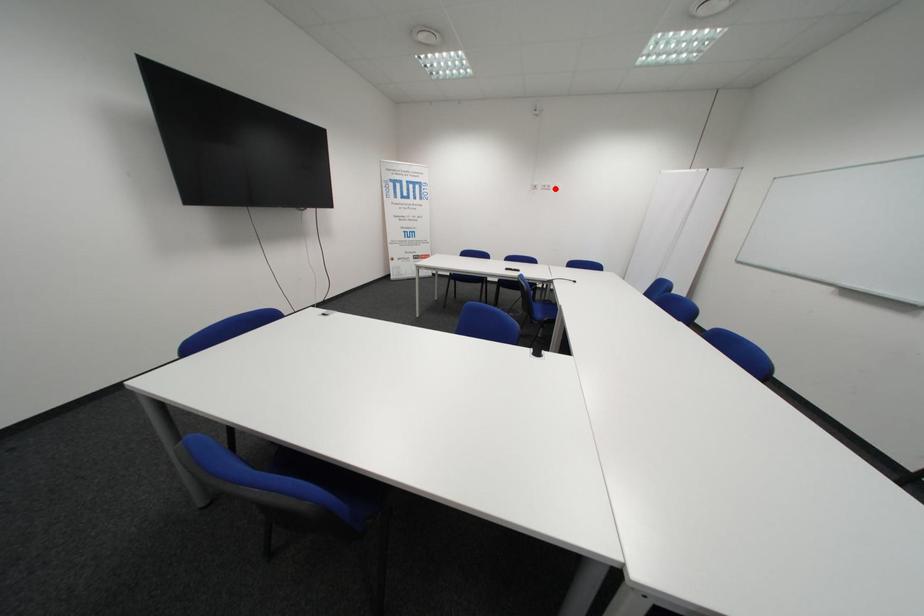
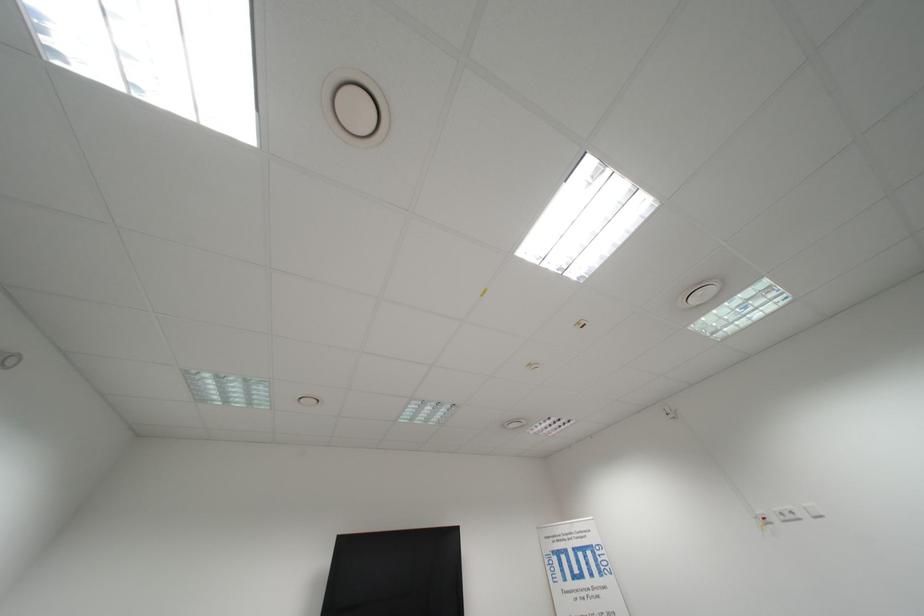
Where in the second image is the point corresponding to the highlighted location from the first image?

(796, 519)